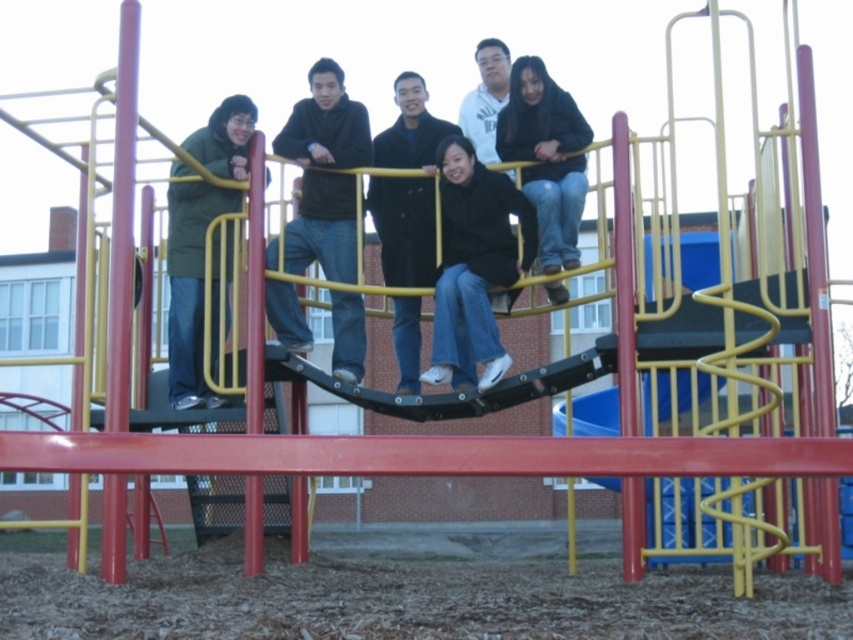
You are standing at the playground and want to take a photo of the point at coordinates (527,208). If your camera has a maximum focus range of 40 meters, will it be able to focus on that point?

The distance of point (527,208) from the camera is 39.07 meters, which is within the camera maximum focus range of 40 meters. So yes, the camera can focus on that point.

You are standing at the playground and want to reach the point marked as point (334, 141). If your walking speed is 3 feet per second, how many seconds will it take you to reach that point?

The point (334, 141) is 137.81 feet away from the viewer. At a walking speed of 3 feet per second, it would take approximately 45.94 seconds to reach the point.

You are a photographer trying to capture a group photo of the black matte jacket at center and the white matte jacket at upper center. Since you want both jackets to appear equally sized in the photo, which jacket should you move closer to the camera?

The black matte jacket at center has a lesser width compared to the white matte jacket at upper center, so you should move the black matte jacket at center closer to the camera to make them appear the same size in the photo.